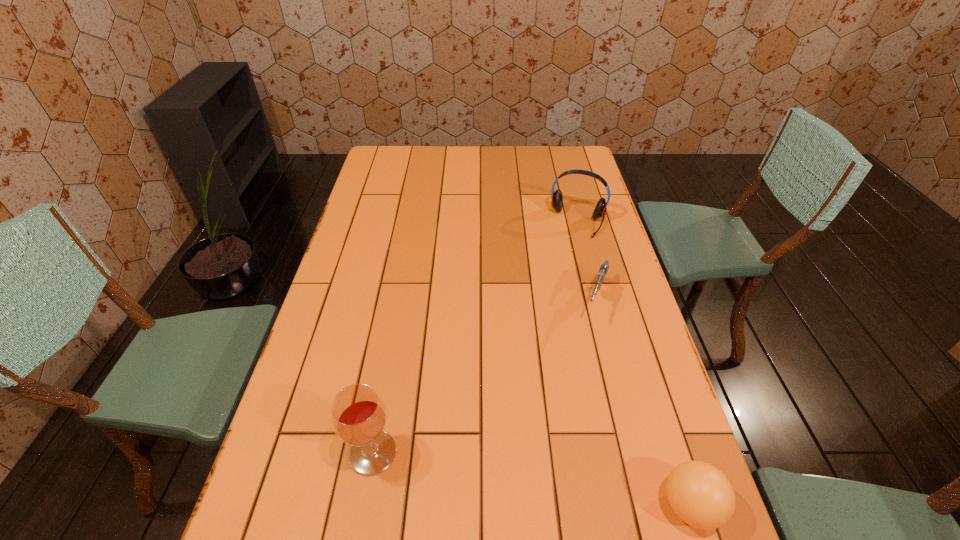
The height and width of the screenshot is (540, 960). Find the location of `vacant space positioned 0.310m at the barrel of the second farthest object`. vacant space positioned 0.310m at the barrel of the second farthest object is located at coordinates (562, 417).

Locate an element on the screen. The width and height of the screenshot is (960, 540). object that is at the near edge is located at coordinates (700, 494).

Locate an element on the screen. This screenshot has height=540, width=960. ping-pong ball that is at the right edge is located at coordinates (700, 494).

The image size is (960, 540). What are the coordinates of `headset that is positioned at the right edge` in the screenshot? It's located at (556, 197).

Identify the location of gun at the right edge. (603, 270).

Find the location of a particular element. object located in the near right corner section of the desktop is located at coordinates (700, 494).

Where is `vacant area at the far edge of the desktop`? The height and width of the screenshot is (540, 960). vacant area at the far edge of the desktop is located at coordinates (492, 145).

In the image, there is a desktop. Identify the location of vacant region at the near edge. (541, 498).

Where is `vacant area at the left edge`? This screenshot has width=960, height=540. vacant area at the left edge is located at coordinates (367, 188).

In the image, there is a desktop. Where is `blank space at the right edge`? blank space at the right edge is located at coordinates (582, 241).